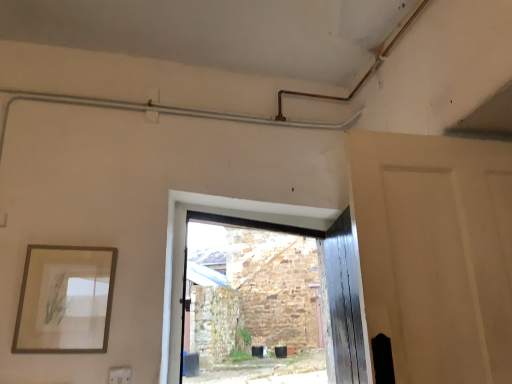
Question: Can you confirm if white plastic electric outlet at lower left is positioned to the right of matte white door at right?

Choices:
 (A) no
 (B) yes

Answer: (A)

Question: From the image's perspective, is white plastic electric outlet at lower left beneath matte white door at right?

Choices:
 (A) yes
 (B) no

Answer: (A)

Question: Is white plastic electric outlet at lower left shorter than matte white door at right?

Choices:
 (A) yes
 (B) no

Answer: (A)

Question: Is the depth of white plastic electric outlet at lower left less than that of matte white door at right?

Choices:
 (A) yes
 (B) no

Answer: (B)

Question: Does white plastic electric outlet at lower left appear on the left side of matte white door at right?

Choices:
 (A) yes
 (B) no

Answer: (A)

Question: From their relative heights in the image, would you say matte white door at right is taller or shorter than white plastic electric outlet at lower left?

Choices:
 (A) tall
 (B) short

Answer: (A)

Question: In the image, is matte white door at right positioned in front of or behind white plastic electric outlet at lower left?

Choices:
 (A) front
 (B) behind

Answer: (A)

Question: Based on their sizes in the image, would you say matte white door at right is bigger or smaller than white plastic electric outlet at lower left?

Choices:
 (A) big
 (B) small

Answer: (A)

Question: From a real-world perspective, is matte white door at right physically located above or below white plastic electric outlet at lower left?

Choices:
 (A) above
 (B) below

Answer: (A)

Question: Is matte white door at right bigger or smaller than wooden picture frame at left?

Choices:
 (A) big
 (B) small

Answer: (A)

Question: From a real-world perspective, is matte white door at right physically located above or below wooden picture frame at left?

Choices:
 (A) below
 (B) above

Answer: (B)

Question: Is point (423, 175) closer or farther from the camera than point (50, 334)?

Choices:
 (A) farther
 (B) closer

Answer: (B)

Question: Based on their positions, is matte white door at right located to the left or right of wooden picture frame at left?

Choices:
 (A) right
 (B) left

Answer: (A)

Question: In terms of width, does wooden picture frame at left look wider or thinner when compared to white plastic electric outlet at lower left?

Choices:
 (A) thin
 (B) wide

Answer: (B)

Question: In the image, is wooden picture frame at left positioned in front of or behind white plastic electric outlet at lower left?

Choices:
 (A) behind
 (B) front

Answer: (B)